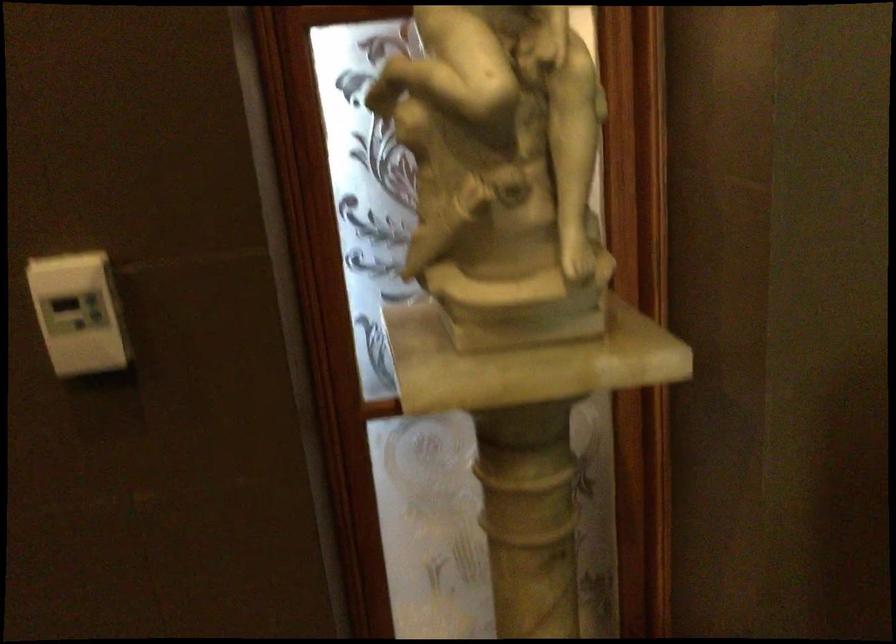
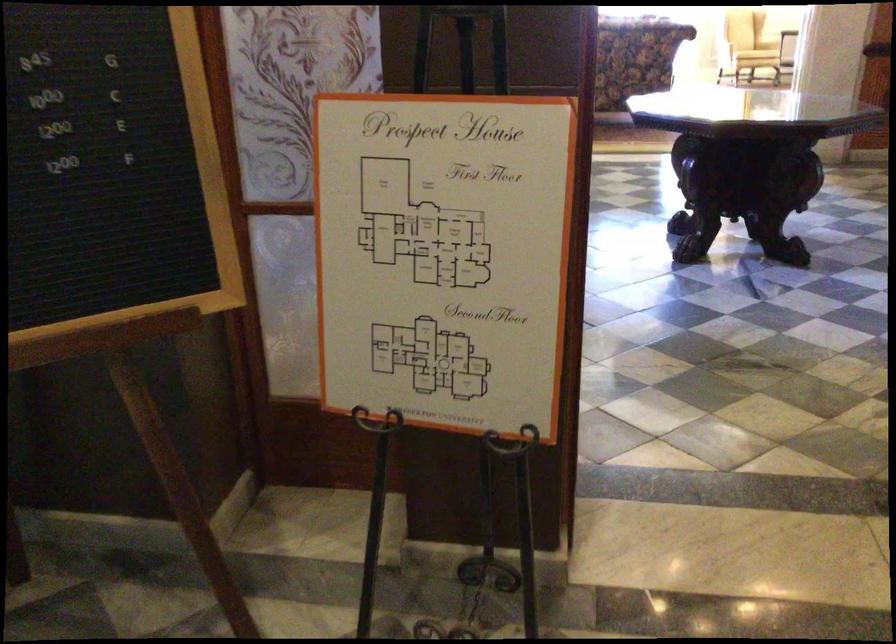
Which direction would the cameraman need to move to produce the second image?

The cameraman walked toward left, backward.